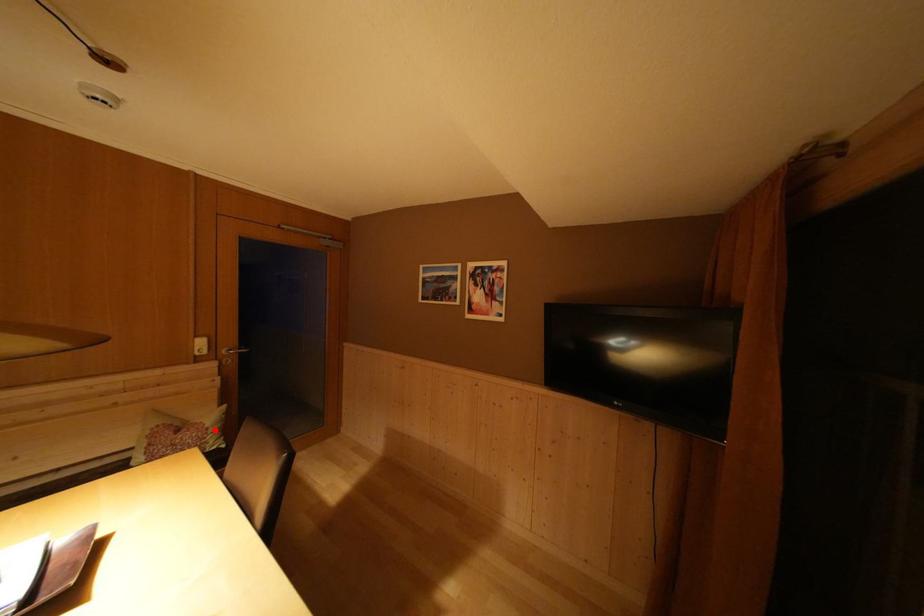
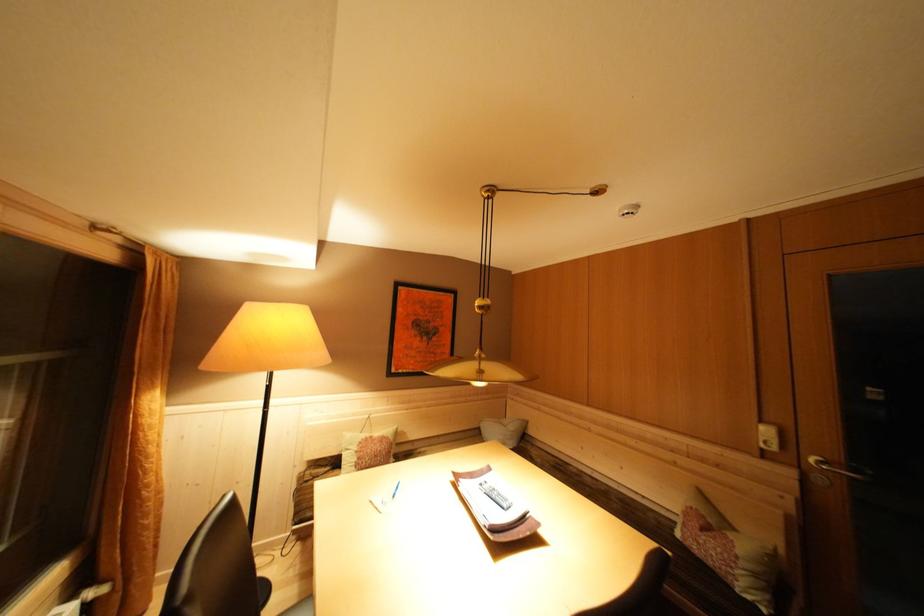
Question: I am providing you with two images of the same scene from different viewpoints. Image1 has a red point marked. In image2, the corresponding 3D location appears at what relative position? Reply with the corresponding letter.

Choices:
 (A) Closer
 (B) Farther

Answer: (A)